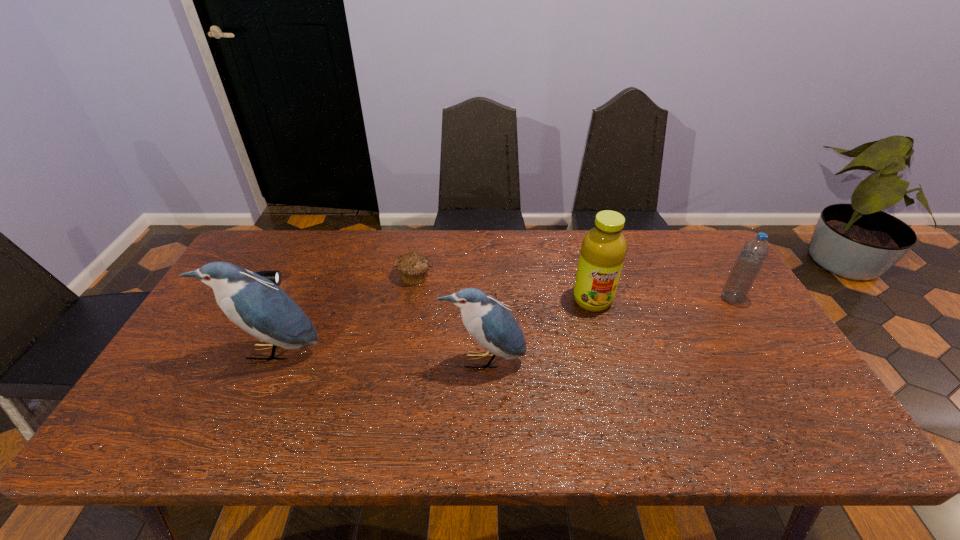
Image resolution: width=960 pixels, height=540 pixels. I want to click on vacant area at the right edge, so click(x=754, y=372).

The image size is (960, 540). In the image, there is a desktop. Identify the location of free space at the far left corner. click(x=260, y=264).

In the image, there is a desktop. At what (x,y) coordinates should I click in order to perform the action: click on blank space at the near left corner. Please return your answer as a coordinate pair (x, y). This screenshot has height=540, width=960. Looking at the image, I should click on (150, 393).

Identify the location of vacant space at the near right corner of the desktop. (783, 410).

Locate an element on the screen. Image resolution: width=960 pixels, height=540 pixels. empty space that is in between the right bird and the rightmost object is located at coordinates (607, 330).

At what (x,y) coordinates should I click in order to perform the action: click on unoccupied area between the fruit juice and the fourth object from left to right. Please return your answer as a coordinate pair (x, y). The image size is (960, 540). Looking at the image, I should click on (538, 330).

Find the location of a particular element. The image size is (960, 540). unoccupied area between the muffin and the shortest object is located at coordinates (334, 279).

Find the location of a particular element. The image size is (960, 540). free space that is in between the second object from right to left and the shortest object is located at coordinates (422, 292).

At what (x,y) coordinates should I click in order to perform the action: click on unoccupied position between the right bird and the water bottle. Please return your answer as a coordinate pair (x, y). Looking at the image, I should click on (607, 330).

At what (x,y) coordinates should I click in order to perform the action: click on free space that is in between the shortest object and the shorter bird. Please return your answer as a coordinate pair (x, y). This screenshot has width=960, height=540. Looking at the image, I should click on (368, 322).